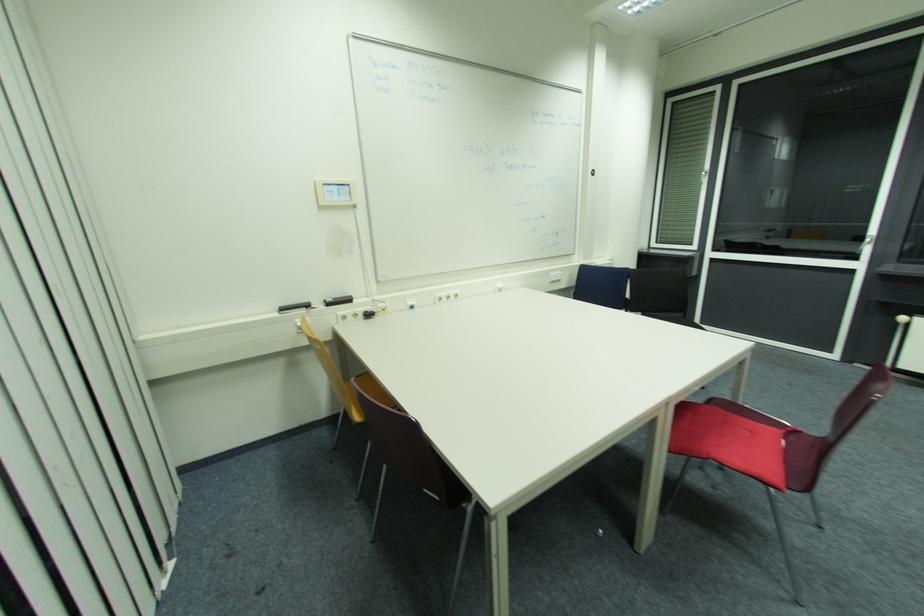
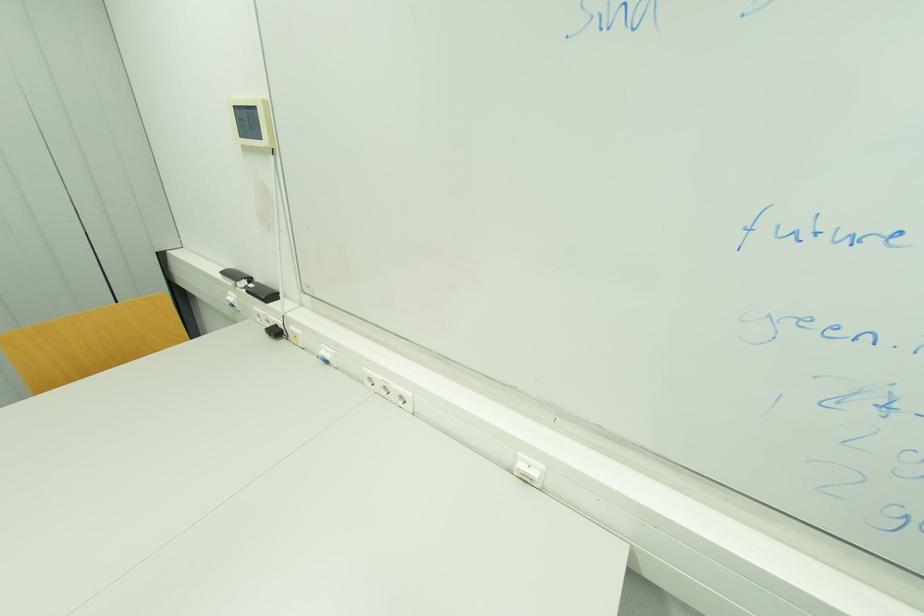
Locate, in the second image, the point that corresponds to (329,185) in the first image.

(237, 108)